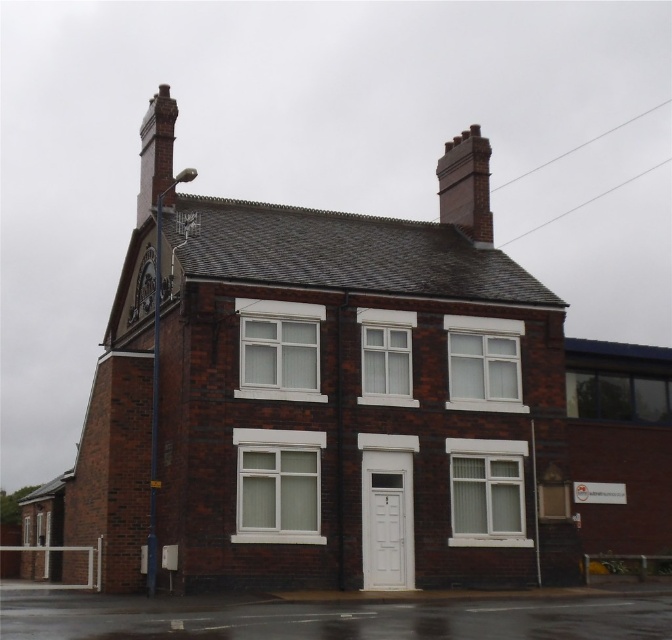
Question: Among these objects, which one is farthest from the camera?

Choices:
 (A) brick chimney at upper right
 (B) red brick chimney at upper left

Answer: (A)

Question: Based on their relative distances, which object is nearer to the dark red brick chimney at center?

Choices:
 (A) brick chimney at upper right
 (B) red brick chimney at upper left

Answer: (B)

Question: Is dark red brick chimney at center above brick chimney at upper right?

Choices:
 (A) yes
 (B) no

Answer: (B)

Question: Which object appears farthest from the camera in this image?

Choices:
 (A) red brick chimney at upper left
 (B) dark red brick chimney at center

Answer: (A)

Question: Does dark red brick chimney at center have a greater width compared to red brick chimney at upper left?

Choices:
 (A) yes
 (B) no

Answer: (B)

Question: Observing the image, what is the correct spatial positioning of brick chimney at upper right in reference to red brick chimney at upper left?

Choices:
 (A) right
 (B) left

Answer: (A)